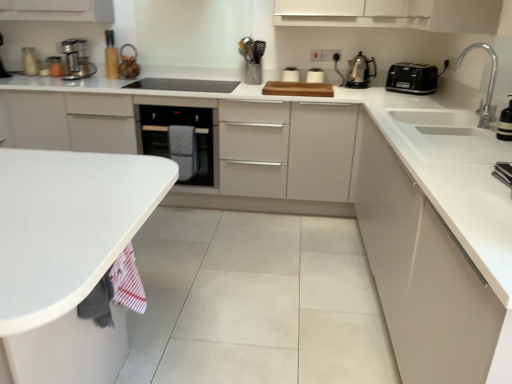
Question: From the image's perspective, is black plastic toaster at upper right, the 1th kitchen appliance when ordered from right to left, positioned above or below white glossy sink at right?

Choices:
 (A) above
 (B) below

Answer: (A)

Question: Considering the positions of black plastic toaster at upper right, the 1th kitchen appliance when ordered from right to left, and white glossy sink at right in the image, is black plastic toaster at upper right, the 1th kitchen appliance when ordered from right to left, taller or shorter than white glossy sink at right?

Choices:
 (A) short
 (B) tall

Answer: (B)

Question: Based on their relative distances, which object is nearer to the white glossy toaster at upper center, acting as the 3th appliance starting from the left?

Choices:
 (A) black glass oven at center
 (B) metallic silver faucet at upper right, positioned as the first appliance in right-to-left order
 (C) white matte sink at right
 (D) metallic silver toaster at upper right, the 1th appliance viewed from the front
 (E) white glossy sink at right

Answer: (A)

Question: Which is farther from the metallic silver faucet at upper right, positioned as the first appliance in right-to-left order?

Choices:
 (A) black plastic toaster at upper right, the 1th kitchen appliance when ordered from right to left
 (B) metallic stainless steel coffee maker at left, which is counted as the first kitchen appliance, starting from the left
 (C) matte plastic utensil holder at upper center, the 3th appliance positioned from the back
 (D) metallic silver toaster at upper right, the sixth appliance from the top
 (E) polished stainless steel kettle at upper right, placed as the second kitchen appliance when sorted from left to right

Answer: (B)